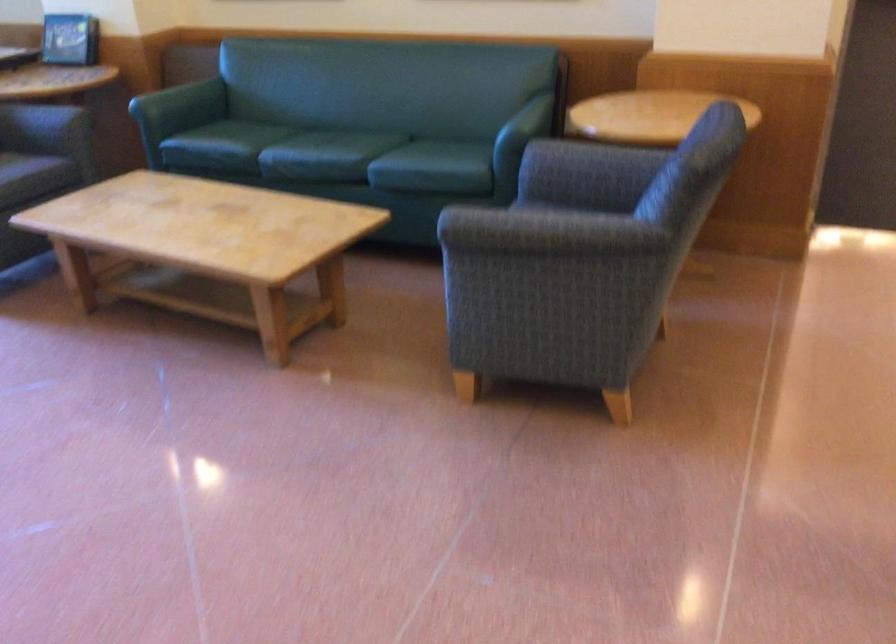
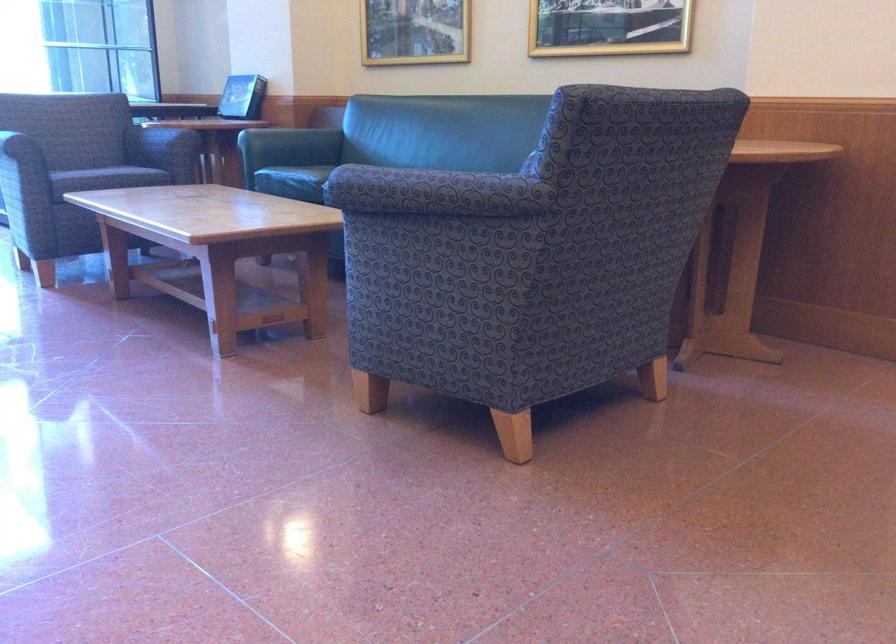
Where in the second image is the point corresponding to the point at 220,152 from the first image?

(293, 182)